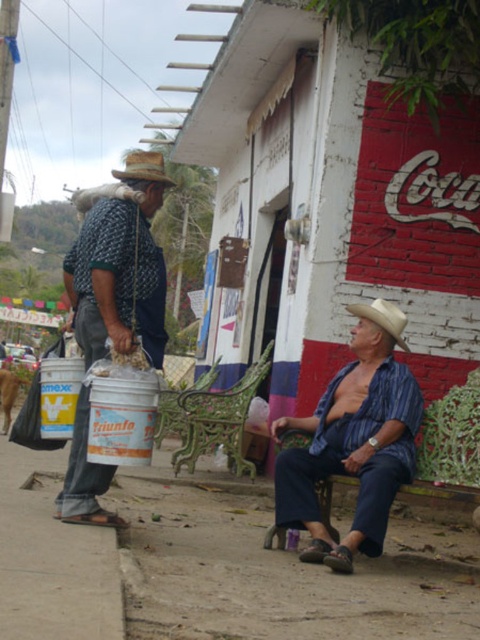
You are a delivery person who needs to choose a container to carry a small package. You see the matte black bucket at left and the rustic straw cowboy hat at left. Which container has a smaller size and is better suited for carrying a small package?

The matte black bucket at left has a smaller size compared to the rustic straw cowboy hat at left, so it is better suited for carrying a small package.

You are a delivery person who needs to place the matte white bucket at left and the blue striped shirt at center into a storage box. The box has a height limit of 1 meter. Given their heights, can both items fit vertically inside the box?

The matte white bucket at left has a lesser height compared to blue striped shirt at center. Since the blue striped shirt at center is taller than the matte white bucket at left and the box has a height limit of 1 meter, both items can fit vertically as long as the tallest item, the blue striped shirt at center, is under 1 meter in height. However, without knowing the exact height of the blue striped shirt at center, we cannot confirm if both will fit. The question does not provide the specific height of 1m

You are a delivery person who needs to place both the matte black bucket at left and the rustic straw cowboy hat at left into a storage box. The box can only accommodate items narrower than 30 cm. Based on the scene, can both items fit inside the box?

The matte black bucket at left has a width less than the rustic straw cowboy hat at left. Since the box requires items narrower than 30 cm, we need to know the exact width of the wider item. However, without specific measurements, we can only assume that if the rustic straw cowboy hat at left is under 30 cm, both would fit. But since the bucket is narrower, if the hat exceeds 30 cm, only the bucket would fit.